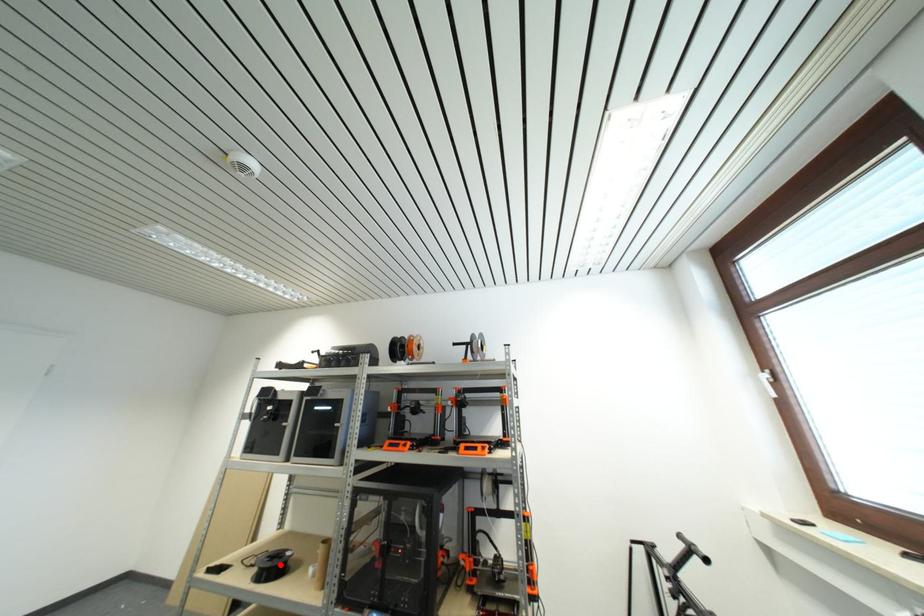
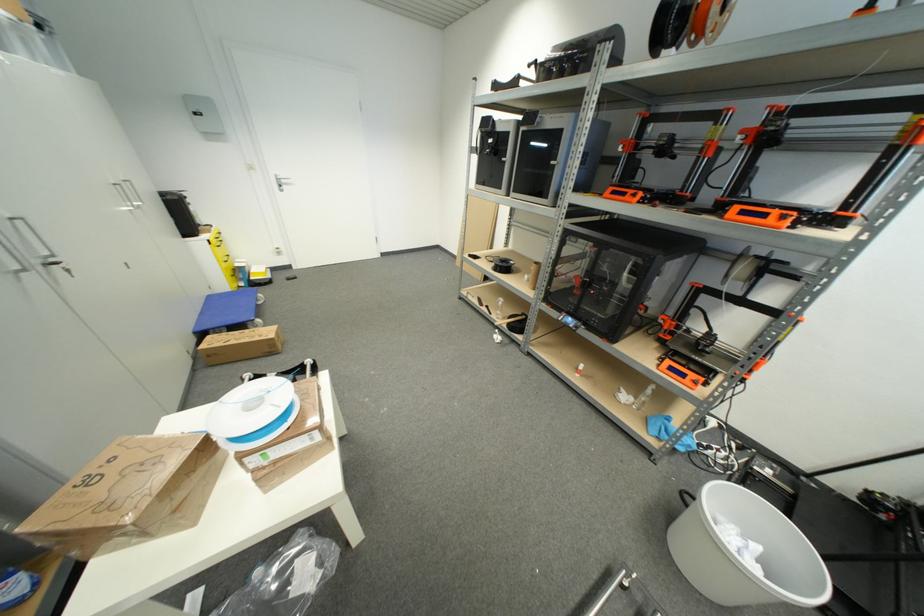
Question: A red point is marked in image1. In image2, is the corresponding 3D point closer to the camera or farther? Reply with the corresponding letter.

Choices:
 (A) The corresponding 3D point is closer.
 (B) The corresponding 3D point is farther.

Answer: (A)